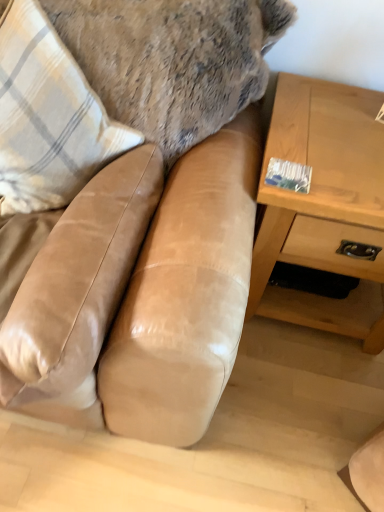
Question: Is tan leather couch at center at the back of plaid fabric pillow at left?

Choices:
 (A) no
 (B) yes

Answer: (B)

Question: Is plaid fabric pillow at left not inside tan leather couch at center?

Choices:
 (A) yes
 (B) no

Answer: (B)

Question: From the image's perspective, does plaid fabric pillow at left appear lower than tan leather couch at center?

Choices:
 (A) yes
 (B) no

Answer: (B)

Question: Can you confirm if plaid fabric pillow at left is positioned to the left of tan leather couch at center?

Choices:
 (A) yes
 (B) no

Answer: (A)

Question: Considering the relative sizes of plaid fabric pillow at left and tan leather couch at center in the image provided, is plaid fabric pillow at left taller than tan leather couch at center?

Choices:
 (A) yes
 (B) no

Answer: (B)

Question: From the image's perspective, is tan leather couch at center above or below suede tan swivel chair at center?

Choices:
 (A) below
 (B) above

Answer: (B)

Question: Is tan leather couch at center bigger or smaller than suede tan swivel chair at center?

Choices:
 (A) big
 (B) small

Answer: (A)

Question: Considering the positions of tan leather couch at center and suede tan swivel chair at center in the image, is tan leather couch at center taller or shorter than suede tan swivel chair at center?

Choices:
 (A) short
 (B) tall

Answer: (B)

Question: Based on their positions, is tan leather couch at center located to the left or right of suede tan swivel chair at center?

Choices:
 (A) right
 (B) left

Answer: (B)

Question: Is point (74, 313) positioned closer to the camera than point (165, 403)?

Choices:
 (A) farther
 (B) closer

Answer: (B)

Question: Considering their positions, is suede tan swivel chair at center located in front of or behind tan leather couch at center?

Choices:
 (A) front
 (B) behind

Answer: (B)

Question: From a real-world perspective, relative to tan leather couch at center, is suede tan swivel chair at center vertically above or below?

Choices:
 (A) above
 (B) below

Answer: (A)

Question: In terms of width, does suede tan swivel chair at center look wider or thinner when compared to tan leather couch at center?

Choices:
 (A) wide
 (B) thin

Answer: (B)

Question: Is point (362, 156) positioned closer to the camera than point (139, 302)?

Choices:
 (A) closer
 (B) farther

Answer: (B)

Question: From a real-world perspective, is light brown wood table at right physically located above or below tan leather couch at center?

Choices:
 (A) below
 (B) above

Answer: (A)